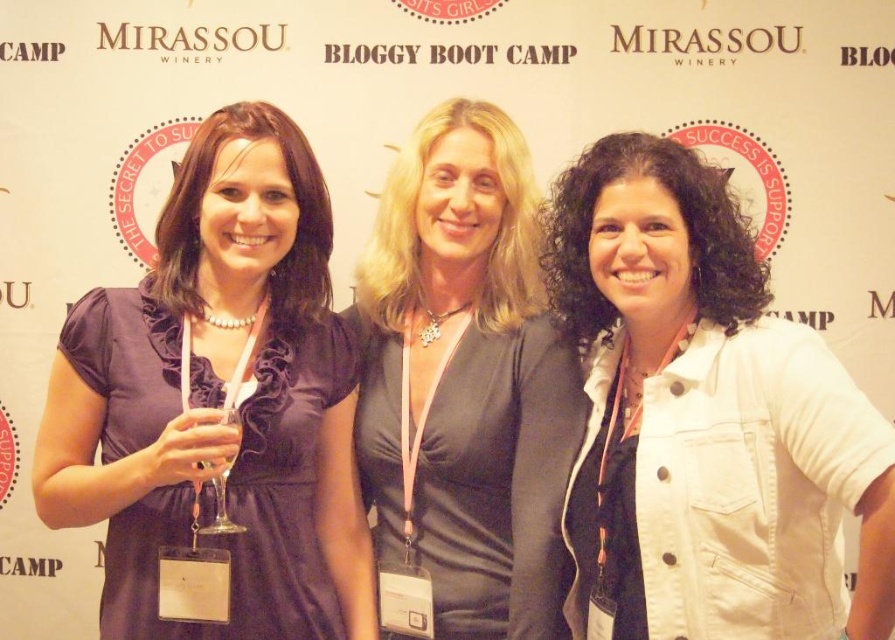
Question: Which point is farther to the camera?

Choices:
 (A) (507, 630)
 (B) (233, 433)

Answer: (A)

Question: Is black satin dress at center bigger than clear glass wine glass at center?

Choices:
 (A) yes
 (B) no

Answer: (A)

Question: Does black satin dress at center have a larger size compared to clear glass wine glass at center?

Choices:
 (A) no
 (B) yes

Answer: (B)

Question: Among these objects, which one is farthest from the camera?

Choices:
 (A) matte purple dress at left
 (B) black satin dress at center
 (C) clear glass wine glass at center

Answer: (B)

Question: Can you confirm if black satin dress at center is positioned below clear glass wine at center?

Choices:
 (A) yes
 (B) no

Answer: (B)

Question: Which point is farther to the camera?

Choices:
 (A) white denim jacket at right
 (B) black satin dress at center

Answer: (B)